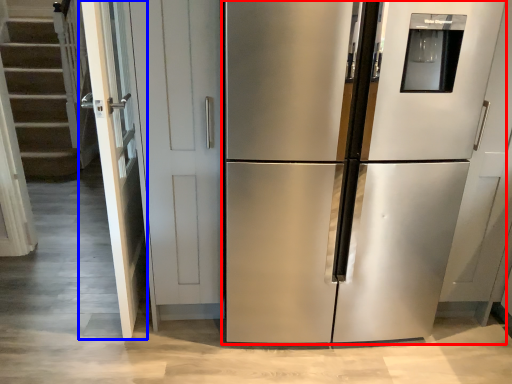
Question: Which object is further to the camera taking this photo, refrigerator (highlighted by a red box) or door (highlighted by a blue box)?

Choices:
 (A) refrigerator
 (B) door

Answer: (B)